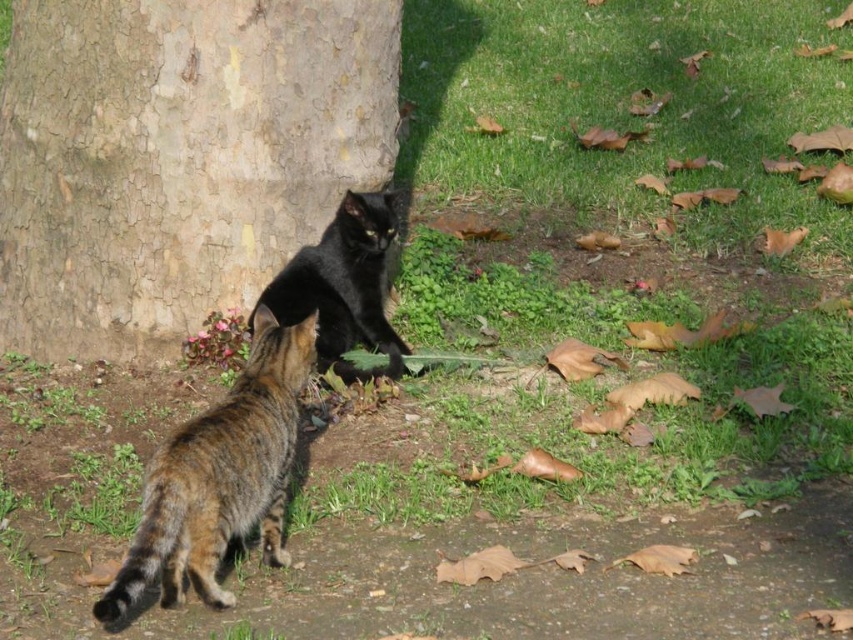
Between tabby fur cat at lower left and shiny black cat at center, which one is positioned higher?

Positioned higher is shiny black cat at center.

Is tabby fur cat at lower left thinner than shiny black cat at center?

Yes, tabby fur cat at lower left is thinner than shiny black cat at center.

The image size is (853, 640). What do you see at coordinates (219, 476) in the screenshot?
I see `tabby fur cat at lower left` at bounding box center [219, 476].

Identify the location of tabby fur cat at lower left. (x=219, y=476).

From the picture: Does smooth bark tree trunk at center have a lesser height compared to tabby fur cat at lower left?

In fact, smooth bark tree trunk at center may be taller than tabby fur cat at lower left.

Which is more to the left, smooth bark tree trunk at center or tabby fur cat at lower left?

smooth bark tree trunk at center is more to the left.

Does point (219, 300) lie in front of point (271, 531)?

No, (219, 300) is behind (271, 531).

I want to click on smooth bark tree trunk at center, so click(x=177, y=157).

Is smooth bark tree trunk at center above shiny black cat at center?

Yes.

The width and height of the screenshot is (853, 640). What do you see at coordinates (177, 157) in the screenshot?
I see `smooth bark tree trunk at center` at bounding box center [177, 157].

Who is more forward, (169,122) or (386,349)?

Point (169,122)

Find the location of a particular element. The image size is (853, 640). smooth bark tree trunk at center is located at coordinates (177, 157).